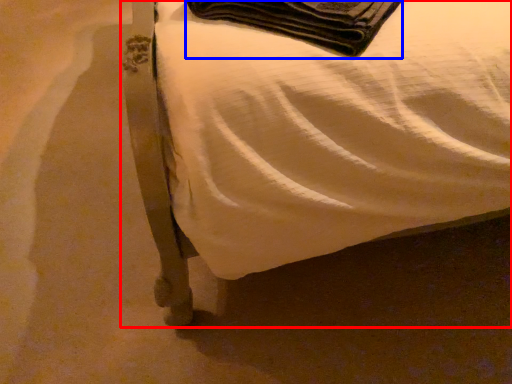
Question: Which of the following is the farthest to the observer, furniture (highlighted by a red box) or blanket (highlighted by a blue box)?

Choices:
 (A) furniture
 (B) blanket

Answer: (B)